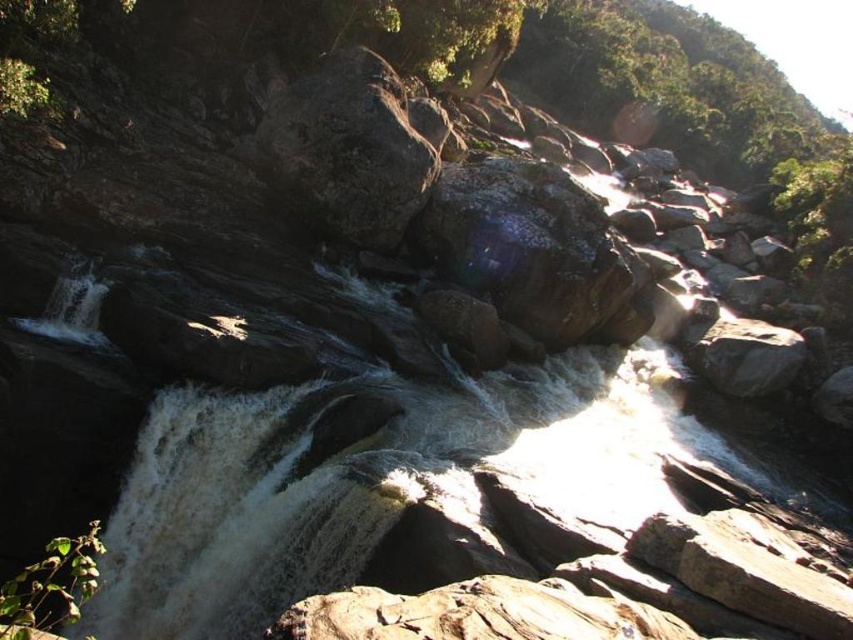
Which is above, glossy dark rock at center or rough stone boulder at center?

rough stone boulder at center is above.

Find the location of a particular element. This screenshot has width=853, height=640. glossy dark rock at center is located at coordinates (535, 252).